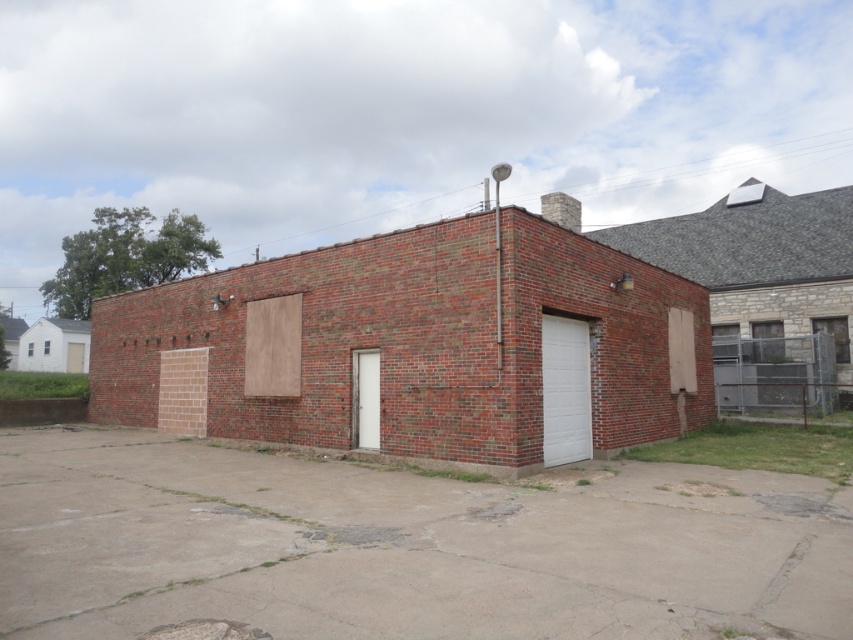
Does brick garage at center come in front of white smooth garage door at center-right?

Yes, it is in front of white smooth garage door at center-right.

What are the coordinates of `brick garage at center` in the screenshot? It's located at (416, 348).